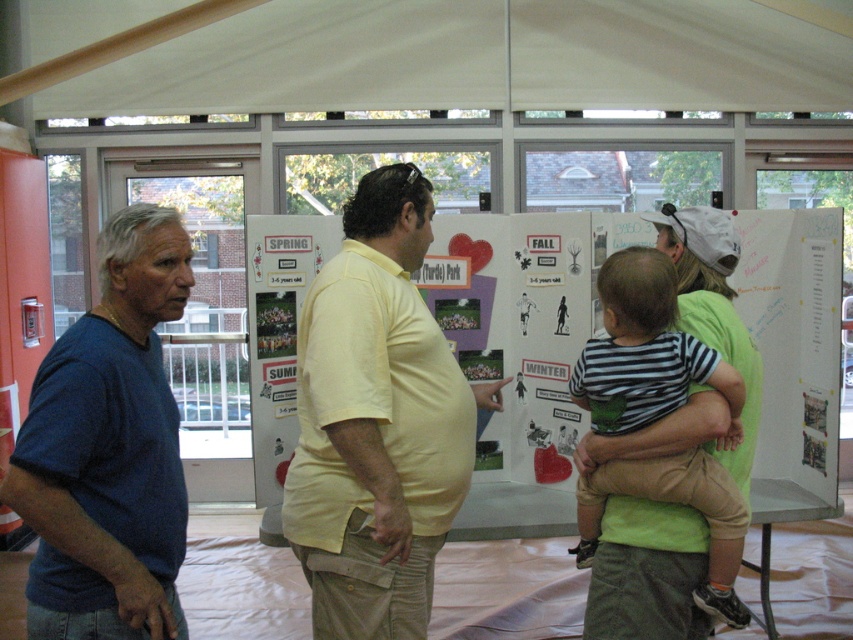
What is the color of the clothing worn by the person standing at the coordinates point (376, 420)?

The yellow cotton shirt at center is located at point (376, 420), so the color of the clothing is yellow.